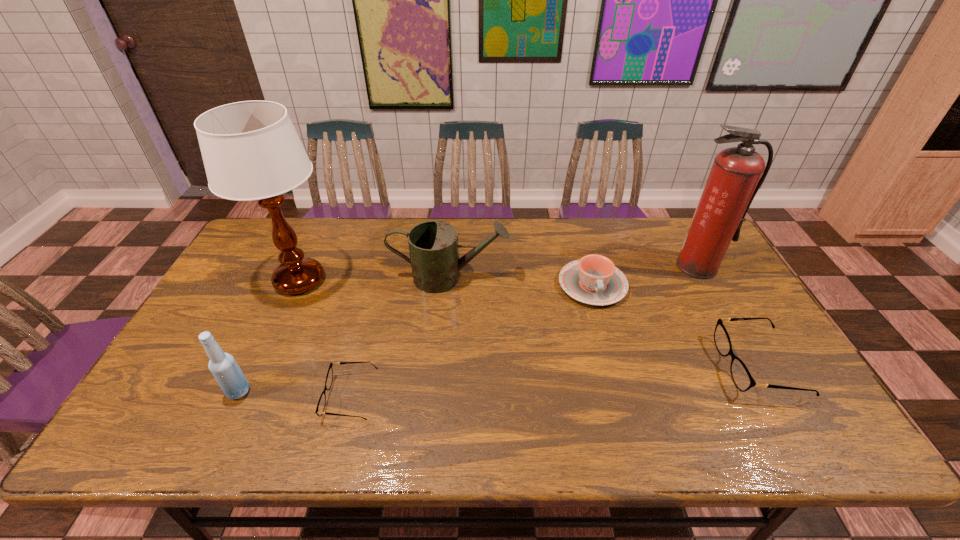
I want to click on free space located 0.090m on the front-facing side of the shorter spectacles, so 290,397.

What are the coordinates of `free location located on the front-facing side of the shorter spectacles` in the screenshot? It's located at (281, 397).

The height and width of the screenshot is (540, 960). Identify the location of free space located on the front-facing side of the shorter spectacles. (186, 397).

The image size is (960, 540). What are the coordinates of `vacant space located 0.340m on the front-facing side of the second shortest object` in the screenshot? It's located at (592, 366).

This screenshot has height=540, width=960. What are the coordinates of `free space located 0.210m on the front-facing side of the second shortest object` in the screenshot? It's located at (643, 366).

At what (x,y) coordinates should I click in order to perform the action: click on free space located on the front-facing side of the second shortest object. Please return your answer as a coordinate pair (x, y). Image resolution: width=960 pixels, height=540 pixels. Looking at the image, I should click on (670, 366).

The height and width of the screenshot is (540, 960). In order to click on vacant space located 0.080m on the front of the table lamp in this screenshot , I will do `click(277, 330)`.

Locate an element on the screen. Image resolution: width=960 pixels, height=540 pixels. vacant space positioned 0.250m with the spout on the watering can is located at coordinates (588, 278).

Image resolution: width=960 pixels, height=540 pixels. In order to click on free location located at the nozzle of the fire extinguisher in this screenshot , I will do `click(731, 325)`.

You are a GUI agent. You are given a task and a screenshot of the screen. Output one action in this format:
    pyautogui.click(x=<x>, y=<y>)
    Task: Click on the vacant space located on the handle side of the fifth tallest object
    
    Given the screenshot: What is the action you would take?
    pyautogui.click(x=625, y=404)